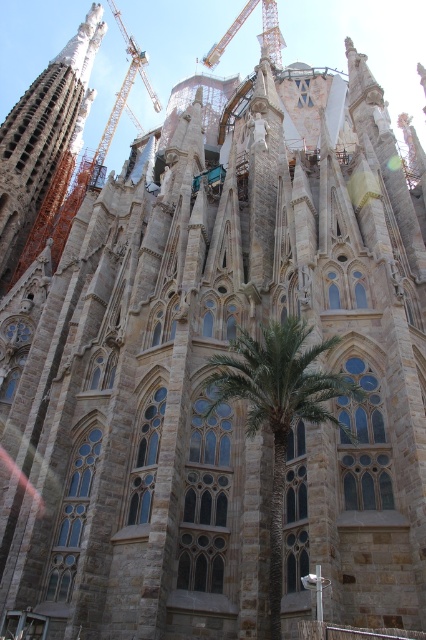
Who is more forward, (221, 392) or (273, 60)?

Positioned in front is point (221, 392).

Can you confirm if green leafy palm tree at center is wider than metallic construction crane at upper center?

No, green leafy palm tree at center is not wider than metallic construction crane at upper center.

Is point (279, 602) farther from viewer compared to point (207, 54)?

No, it is in front of (207, 54).

This screenshot has width=426, height=640. I want to click on green leafy palm tree at center, so click(x=276, y=406).

Who is more forward, (3, 205) or (278, 38)?

Point (3, 205) is in front.

Image resolution: width=426 pixels, height=640 pixels. What do you see at coordinates (40, 136) in the screenshot?
I see `stone tower at center` at bounding box center [40, 136].

Locate an element on the screen. stone tower at center is located at coordinates (40, 136).

Is green leafy palm tree at center taller than stone tower at center?

No.

Is point (333, 385) closer to viewer compared to point (2, 285)?

Yes, point (333, 385) is closer to viewer.

What are the coordinates of `green leafy palm tree at center` in the screenshot? It's located at (276, 406).